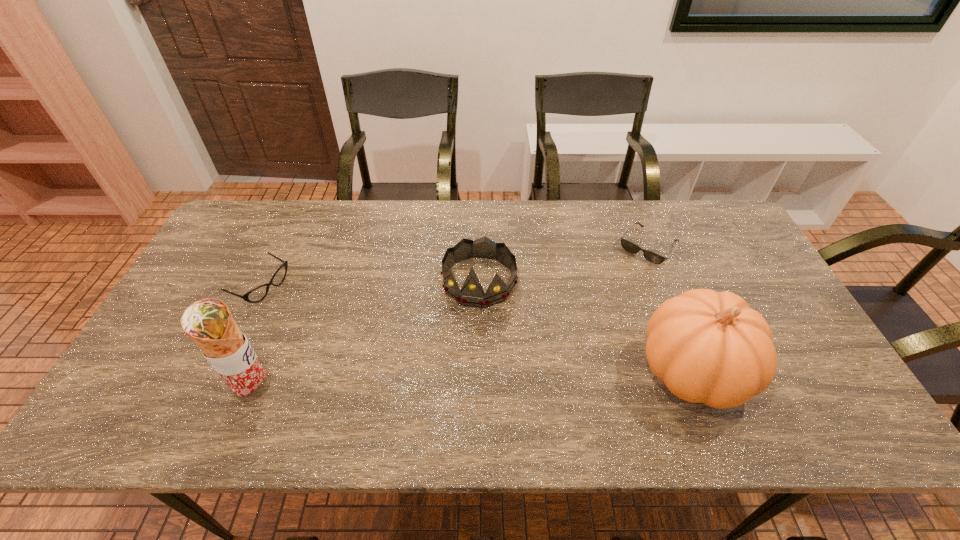
The height and width of the screenshot is (540, 960). I want to click on vacant space located at the front of the third shortest object with jewels, so click(x=457, y=375).

Find the location of a particular element. The width and height of the screenshot is (960, 540). free space located 0.240m on the front-facing side of the shortest object is located at coordinates (596, 309).

At what (x,y) coordinates should I click in order to perform the action: click on vacant region located on the front-facing side of the shortest object. Please return your answer as a coordinate pair (x, y). The width and height of the screenshot is (960, 540). Looking at the image, I should click on (619, 281).

Identify the location of vacant space positioned on the front-facing side of the shortest object. (610, 293).

The image size is (960, 540). Identify the location of free region located on the front-facing side of the second shortest object. (328, 321).

Find the location of a particular element. vacant region located 0.380m on the front-facing side of the second shortest object is located at coordinates (389, 351).

Locate an element on the screen. free spot located 0.340m on the front-facing side of the second shortest object is located at coordinates (376, 345).

Where is `object at the far edge`? Image resolution: width=960 pixels, height=540 pixels. object at the far edge is located at coordinates (655, 258).

Image resolution: width=960 pixels, height=540 pixels. What are the coordinates of `burrito positioned at the near edge` in the screenshot? It's located at (208, 322).

What are the coordinates of `pumpkin at the near edge` in the screenshot? It's located at (709, 347).